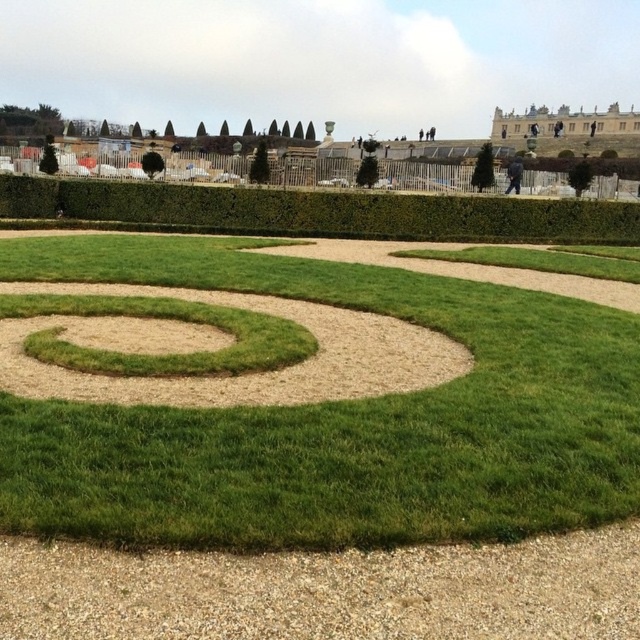
You are planning to walk from the gray gravel at bottom to the green grass at center in the garden. According to the garden layout, is this path possible?

The gray gravel at bottom is behind green grass at center, so you cannot walk directly from the gray gravel at bottom to the green grass at center as they are positioned in opposite spatial relations.

You are planning to place a decorative statue in the garden. The statue requires a base that can fit on either the green hedge at upper center or the green grass spiral at center. Based on the sizes of these two areas, which location would be more suitable for the statue?

The green hedge at upper center is bigger than the green grass spiral at center, so it would be more suitable for placing the statue as it provides a larger and more stable base.

You are planning to place a small garden statue exactly in the middle of the green grass at center and the green hedge at upper center. Which object will the statue be closer to?

The statue will be closer to the green grass at center because it has a lesser width compared to the green hedge at upper center.